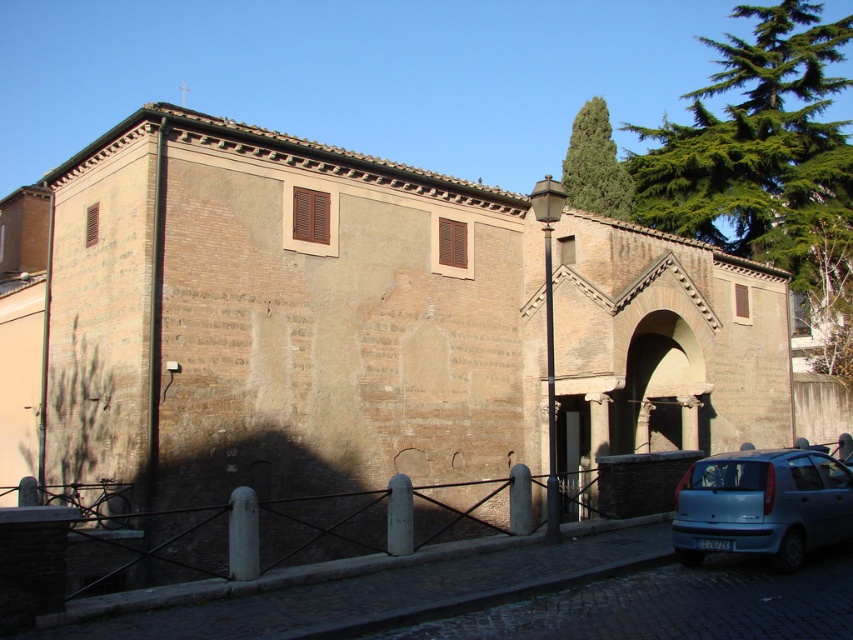
You are a delivery driver who needs to park your blue matte car at lower right in the parking lot behind the historic building. However, there is a whiteplasticlicense plate at lower center blocking the entrance. Can your car pass under the entrance without hitting the license plate?

The blue matte car at lower right is taller than the whiteplasticlicense plate at lower center, so the car cannot pass under the entrance without hitting the license plate.

You are a delivery driver who needs to enter the building through the entrance. The smooth stone archway at center is the entrance. However, there is a whiteplasticlicense plate at lower center blocking the path. Can you drive through the entrance without removing the license plate?

The smooth stone archway at center is much taller than the whiteplasticlicense plate at lower center, so you can drive through the entrance without removing the license plate since the archway is tall enough to accommodate your vehicle while the license plate is below the clearance height.

You are an architect designing a new courtyard entrance. You need to ensure that the entranceway is wider than the tree above it. Based on the historic building in the image, will the smooth stone archway at center and the green leafy tree at upper center meet this requirement?

The smooth stone archway at center has a lesser width compared to green leafy tree at upper center, so it does not meet the requirement of being wider than the tree above it.